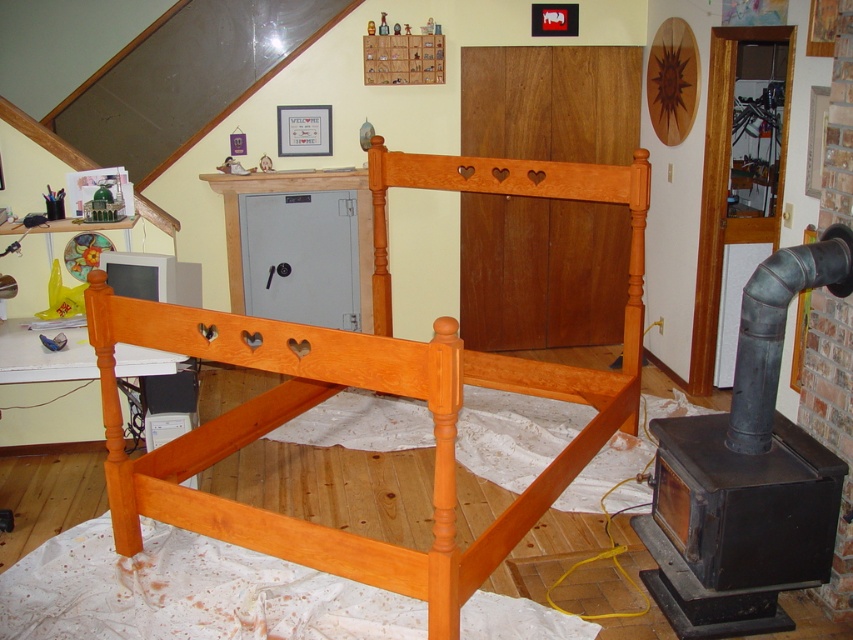
Question: Does cherry wood bunk bed at center have a larger size compared to cherry wood headboard at center?

Choices:
 (A) no
 (B) yes

Answer: (B)

Question: Does cherry wood bunk bed at center come behind cherry wood headboard at center?

Choices:
 (A) no
 (B) yes

Answer: (A)

Question: Does cherry wood bunk bed at center have a smaller size compared to cherry wood headboard at center?

Choices:
 (A) yes
 (B) no

Answer: (B)

Question: Which point is closer to the camera taking this photo?

Choices:
 (A) (213, 458)
 (B) (606, 200)

Answer: (A)